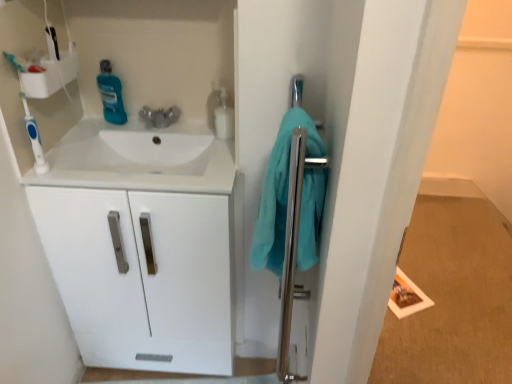
Question: Is teal fabric towel at right not within white glossy sink at upper left?

Choices:
 (A) no
 (B) yes

Answer: (B)

Question: Considering the relative sizes of teal fabric towel at right and white glossy sink at upper left in the image provided, is teal fabric towel at right thinner than white glossy sink at upper left?

Choices:
 (A) no
 (B) yes

Answer: (B)

Question: Can white glossy sink at upper left be found inside teal fabric towel at right?

Choices:
 (A) no
 (B) yes

Answer: (A)

Question: Is teal fabric towel at right looking in the opposite direction of white glossy sink at upper left?

Choices:
 (A) no
 (B) yes

Answer: (A)

Question: Is teal fabric towel at right to the right of white glossy sink at upper left from the viewer's perspective?

Choices:
 (A) no
 (B) yes

Answer: (B)

Question: From a real-world perspective, is teal fabric towel at right below white glossy sink at upper left?

Choices:
 (A) no
 (B) yes

Answer: (A)

Question: Are teal fabric towel at right and polished chrome towel bar at right making contact?

Choices:
 (A) no
 (B) yes

Answer: (B)

Question: Considering the relative positions of teal fabric towel at right and polished chrome towel bar at right in the image provided, is teal fabric towel at right in front of polished chrome towel bar at right?

Choices:
 (A) no
 (B) yes

Answer: (A)

Question: From the image's perspective, is teal fabric towel at right beneath polished chrome towel bar at right?

Choices:
 (A) no
 (B) yes

Answer: (A)

Question: Considering the relative positions of teal fabric towel at right and polished chrome towel bar at right in the image provided, is teal fabric towel at right to the right of polished chrome towel bar at right from the viewer's perspective?

Choices:
 (A) yes
 (B) no

Answer: (B)

Question: Could polished chrome towel bar at right be considered to be inside teal fabric towel at right?

Choices:
 (A) no
 (B) yes

Answer: (A)

Question: Considering the relative sizes of teal fabric towel at right and polished chrome towel bar at right in the image provided, is teal fabric towel at right taller than polished chrome towel bar at right?

Choices:
 (A) yes
 (B) no

Answer: (B)

Question: From the image's perspective, would you say blue plastic toothbrush at left is shown under teal fabric towel at right?

Choices:
 (A) yes
 (B) no

Answer: (B)